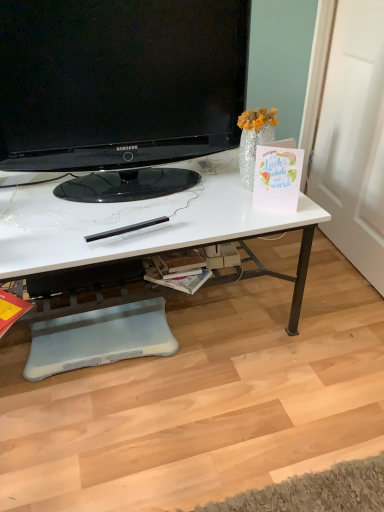
You are a GUI agent. You are given a task and a screenshot of the screen. Output one action in this format:
    pyautogui.click(x=<x>, y=<y>)
    Task: Click on the free space in front of black glossy television at upper center
    The image size is (384, 512).
    Given the screenshot: What is the action you would take?
    pyautogui.click(x=114, y=225)